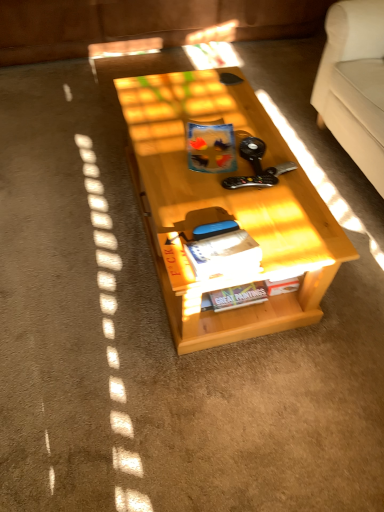
Locate an element on the screen. The width and height of the screenshot is (384, 512). vacant space to the right of matte plastic book at center, which is the second book in back-to-front order is located at coordinates (282, 162).